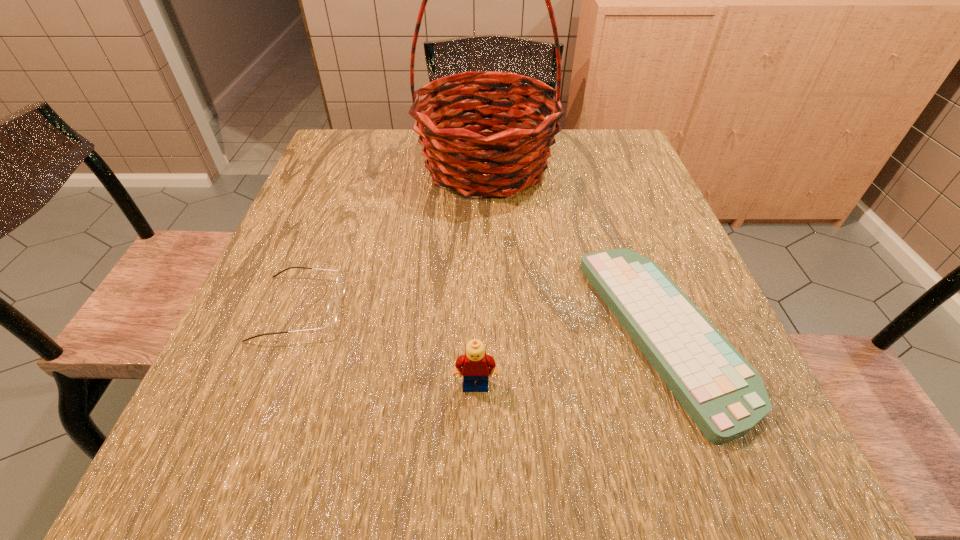
Where is `free spot between the spectacles and the Lego`? The image size is (960, 540). free spot between the spectacles and the Lego is located at coordinates (388, 347).

Identify which object is located as the second nearest to the basket. Please provide its 2D coordinates. Your answer should be formatted as a tuple, i.e. [(x, y)], where the tuple contains the x and y coordinates of a point satisfying the conditions above.

[(340, 282)]

Find the location of a particular element. the closest object to the Lego is located at coordinates (725, 396).

I want to click on vacant position in the image that satisfies the following two spatial constraints: 1. on the front side of the farthest object; 2. through the lenses of the leftmost object, so click(x=489, y=308).

Locate an element on the screen. The image size is (960, 540). vacant point that satisfies the following two spatial constraints: 1. through the lenses of the leftmost object; 2. on the left side of the rightmost object is located at coordinates (291, 334).

Locate an element on the screen. Image resolution: width=960 pixels, height=540 pixels. free spot that satisfies the following two spatial constraints: 1. on the front side of the rightmost object; 2. on the left side of the basket is located at coordinates (490, 334).

Identify the location of free location that satisfies the following two spatial constraints: 1. through the lenses of the third tallest object; 2. on the left side of the shortest object. The width and height of the screenshot is (960, 540). (291, 334).

Find the location of a particular element. The width and height of the screenshot is (960, 540). vacant area that satisfies the following two spatial constraints: 1. on the front side of the farthest object; 2. on the left side of the shortest object is located at coordinates (490, 334).